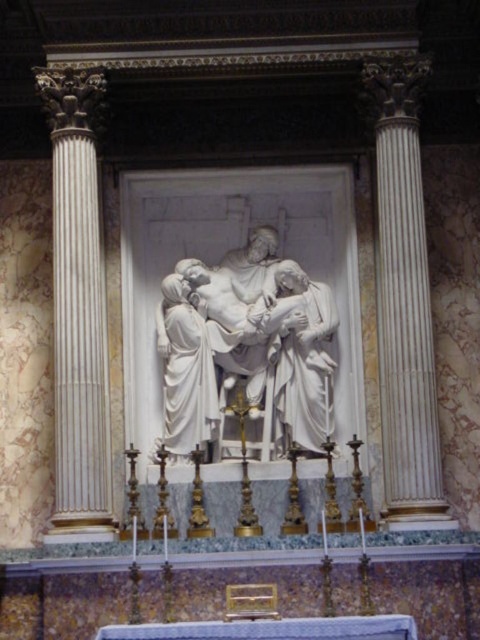
Measure the distance between point [57,406] and camera.

67.77 meters

Identify the location of white marble column at left. (78, 305).

Between white marble column at center and white marble statue at left, which one is positioned lower?

Positioned lower is white marble statue at left.

Is white marble column at center to the right of white marble statue at left from the viewer's perspective?

Yes, white marble column at center is to the right of white marble statue at left.

What do you see at coordinates (404, 301) in the screenshot?
I see `white marble column at center` at bounding box center [404, 301].

This screenshot has width=480, height=640. Find the location of `white marble column at center`. white marble column at center is located at coordinates (404, 301).

Consider the image. Between white marble column at left and white marble statue at center, which one has more height?

Standing taller between the two is white marble column at left.

Looking at this image, can you confirm if white marble column at left is bigger than white marble statue at center?

Correct, white marble column at left is larger in size than white marble statue at center.

Image resolution: width=480 pixels, height=640 pixels. Find the location of `white marble column at left`. white marble column at left is located at coordinates pyautogui.click(x=78, y=305).